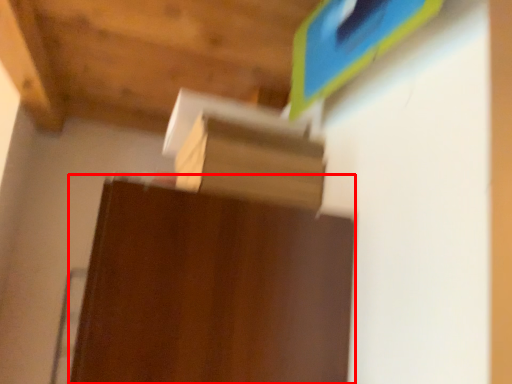
Question: In this image, where is furniture (annotated by the red box) located relative to cardboard box?

Choices:
 (A) right
 (B) left

Answer: (B)